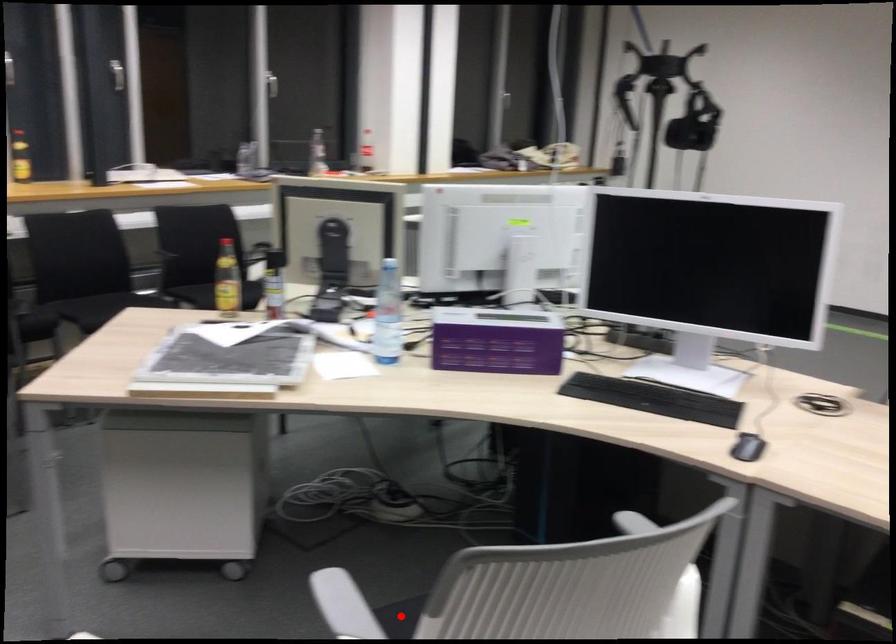
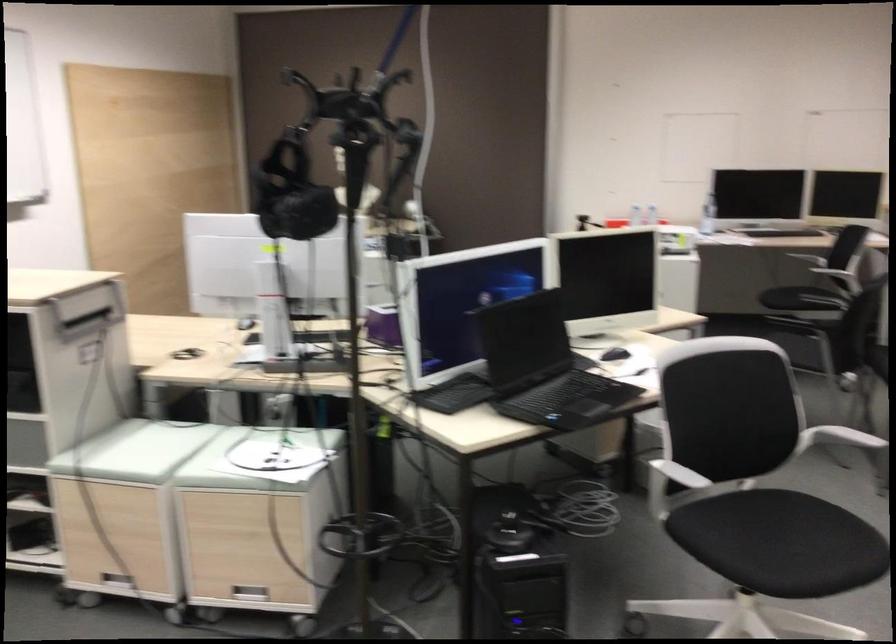
Question: I am providing you with two images of the same scene from different viewpoints. A red point is marked on the first image. Can you still see the location of the red point in image 2?

Choices:
 (A) Yes
 (B) No

Answer: (B)